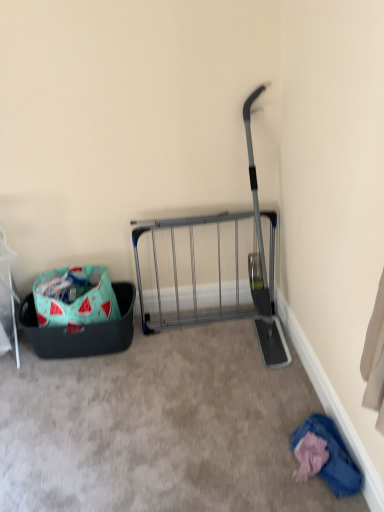
Question: Can you confirm if blue cotton shirt at lower right is thinner than metallic gray rack at center?

Choices:
 (A) no
 (B) yes

Answer: (A)

Question: Is the depth of blue cotton shirt at lower right less than that of metallic gray rack at center?

Choices:
 (A) yes
 (B) no

Answer: (A)

Question: Is blue cotton shirt at lower right further to the viewer compared to metallic gray rack at center?

Choices:
 (A) yes
 (B) no

Answer: (B)

Question: Is blue cotton shirt at lower right oriented towards metallic gray rack at center?

Choices:
 (A) yes
 (B) no

Answer: (B)

Question: Could metallic gray rack at center be considered to be inside blue cotton shirt at lower right?

Choices:
 (A) yes
 (B) no

Answer: (B)

Question: Are blue cotton shirt at lower right and metallic gray rack at center far apart?

Choices:
 (A) yes
 (B) no

Answer: (B)

Question: From the image's perspective, is blue cotton shirt at lower right below watermelon-patterned fabric bag at lower left?

Choices:
 (A) no
 (B) yes

Answer: (B)

Question: From the image's perspective, does blue cotton shirt at lower right appear higher than watermelon-patterned fabric bag at lower left?

Choices:
 (A) no
 (B) yes

Answer: (A)

Question: Is blue cotton shirt at lower right oriented towards watermelon-patterned fabric bag at lower left?

Choices:
 (A) yes
 (B) no

Answer: (B)

Question: Can you confirm if blue cotton shirt at lower right is shorter than watermelon-patterned fabric bag at lower left?

Choices:
 (A) no
 (B) yes

Answer: (B)

Question: From a real-world perspective, is blue cotton shirt at lower right located beneath watermelon-patterned fabric bag at lower left?

Choices:
 (A) yes
 (B) no

Answer: (A)

Question: Is blue cotton shirt at lower right outside of watermelon-patterned fabric bag at lower left?

Choices:
 (A) no
 (B) yes

Answer: (B)

Question: Could blue cotton shirt at lower right be considered to be inside watermelon-patterned fabric bag at lower left?

Choices:
 (A) yes
 (B) no

Answer: (B)